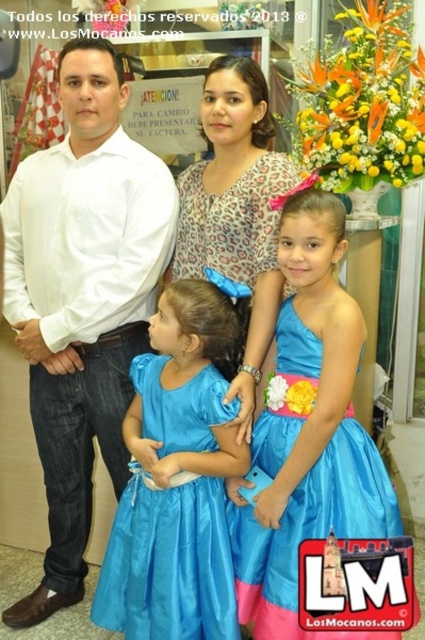
Question: Which of these objects is positioned farthest from the white shirt at left?

Choices:
 (A) blue satin dress at center
 (B) matte leopard print blouse at center

Answer: (A)

Question: Estimate the real-world distances between objects in this image. Which object is closer to the matte leopard print blouse at center?

Choices:
 (A) blue satin dress at center
 (B) white shirt at left
 (C) matte blue dress at center

Answer: (A)

Question: Is white shirt at left above blue satin dress at center?

Choices:
 (A) yes
 (B) no

Answer: (A)

Question: Can you confirm if blue satin dress at center is wider than matte leopard print blouse at center?

Choices:
 (A) no
 (B) yes

Answer: (B)

Question: Estimate the real-world distances between objects in this image. Which object is farther from the matte blue dress at center?

Choices:
 (A) matte leopard print blouse at center
 (B) white shirt at left

Answer: (A)

Question: Considering the relative positions of white shirt at left and blue satin dress at center in the image provided, where is white shirt at left located with respect to blue satin dress at center?

Choices:
 (A) above
 (B) below

Answer: (A)